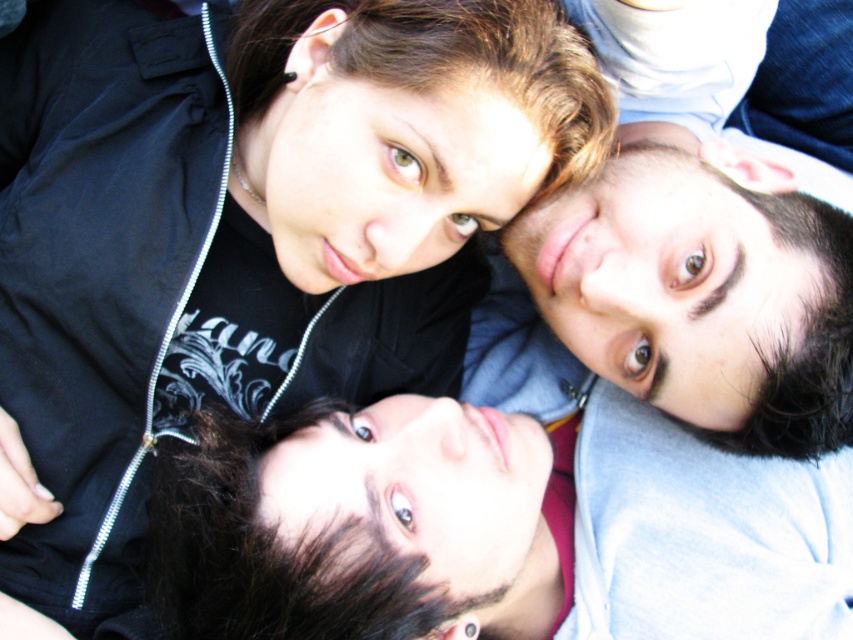
Can you confirm if black matte jacket at upper left is thinner than smooth skin face at center?

Yes, black matte jacket at upper left is thinner than smooth skin face at center.

Where is `black matte jacket at upper left`? The height and width of the screenshot is (640, 853). black matte jacket at upper left is located at coordinates (248, 227).

At what (x,y) coordinates should I click in order to perform the action: click on black matte jacket at upper left. Please return your answer as a coordinate pair (x, y). The height and width of the screenshot is (640, 853). Looking at the image, I should click on (248, 227).

How much distance is there between black matte jacket at upper left and smooth skin face at upper right?

black matte jacket at upper left and smooth skin face at upper right are 12.47 inches apart.

Is black matte jacket at upper left smaller than smooth skin face at upper right?

No, black matte jacket at upper left is not smaller than smooth skin face at upper right.

Between point (138, 307) and point (604, 282), which one is positioned behind?

The point (138, 307) is more distant.

You are a GUI agent. You are given a task and a screenshot of the screen. Output one action in this format:
    pyautogui.click(x=<x>, y=<y>)
    Task: Click on the black matte jacket at upper left
    The width and height of the screenshot is (853, 640).
    Given the screenshot: What is the action you would take?
    pyautogui.click(x=248, y=227)

Is point (213, 467) farther from camera compared to point (695, 1)?

Yes, point (213, 467) is behind point (695, 1).

Who is higher up, smooth skin face at center or smooth skin face at upper right?

Positioned higher is smooth skin face at upper right.

Between point (373, 584) and point (688, 288), which one is positioned in front?

Point (373, 584) is in front.

Find the location of a particular element. The width and height of the screenshot is (853, 640). smooth skin face at center is located at coordinates click(x=457, y=524).